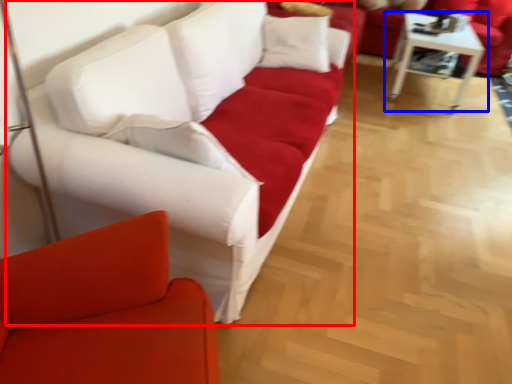
Question: Which object appears closest to the camera in this image, studio couch (highlighted by a red box) or table (highlighted by a blue box)?

Choices:
 (A) studio couch
 (B) table

Answer: (A)